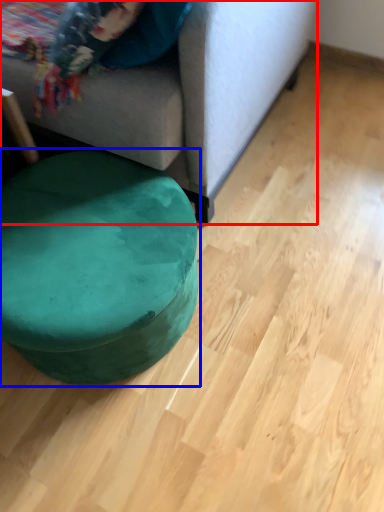
Question: Which point is closer to the camera, studio couch (highlighted by a red box) or bean bag chair (highlighted by a blue box)?

Choices:
 (A) studio couch
 (B) bean bag chair

Answer: (A)